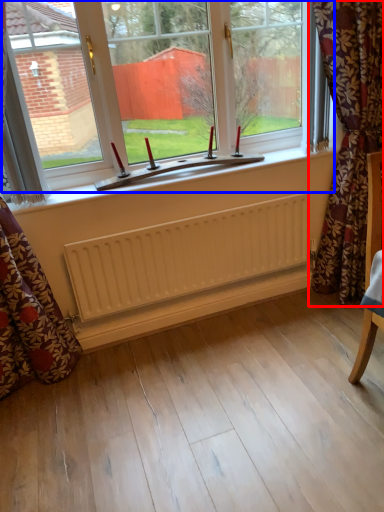
Question: Which point is further to the camera, curtain (highlighted by a red box) or window (highlighted by a blue box)?

Choices:
 (A) curtain
 (B) window

Answer: (B)